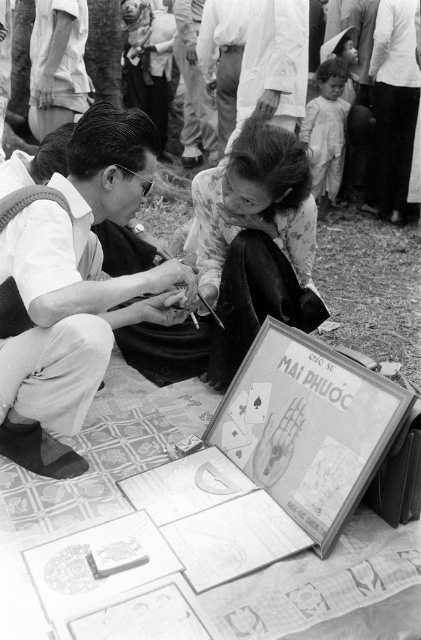
Measure the distance between matte white shirt at center and camera.

5.25 feet

Is point (95, 298) positioned in front of point (202, 180)?

Yes, it is.

Looking at this image, who is more forward, (111, 173) or (253, 244)?

Point (111, 173) is more forward.

Image resolution: width=421 pixels, height=640 pixels. What are the coordinates of `matte white shirt at center` in the screenshot? It's located at (74, 289).